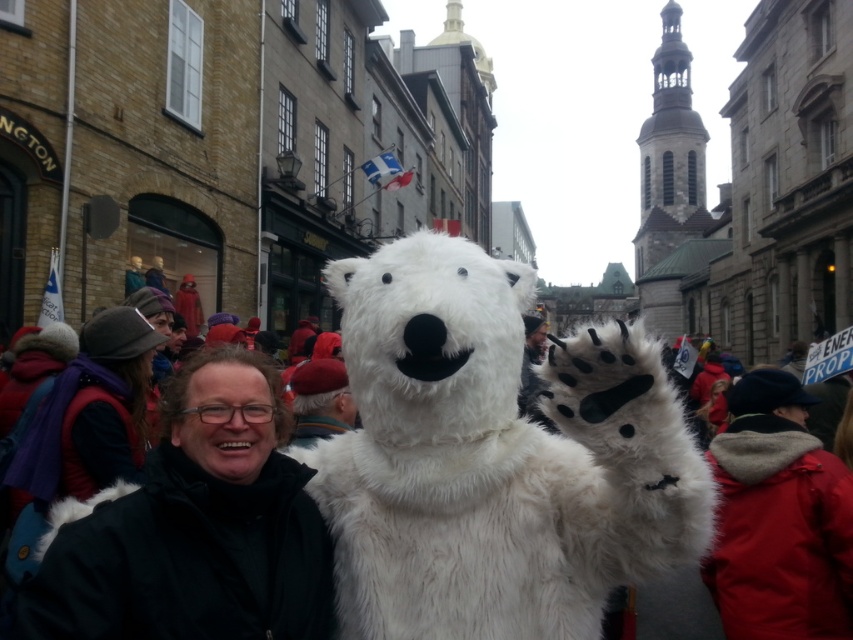
Question: Which object is closer to the camera taking this photo?

Choices:
 (A) white fur hat at center
 (B) red fur coat at lower right

Answer: (B)

Question: Which point is closer to the camera?

Choices:
 (A) black matte jacket at center
 (B) white furry teddy bear at center
 (C) white fur hat at center

Answer: (A)

Question: Observing the image, what is the correct spatial positioning of black matte jacket at center in reference to red fur coat at lower right?

Choices:
 (A) right
 (B) left

Answer: (B)

Question: Among these objects, which one is farthest from the camera?

Choices:
 (A) black matte jacket at center
 (B) white furry teddy bear at center

Answer: (B)

Question: Does white furry teddy bear at center come in front of white fur hat at center?

Choices:
 (A) yes
 (B) no

Answer: (A)

Question: Is white furry teddy bear at center further to the viewer compared to red fur coat at lower right?

Choices:
 (A) no
 (B) yes

Answer: (A)